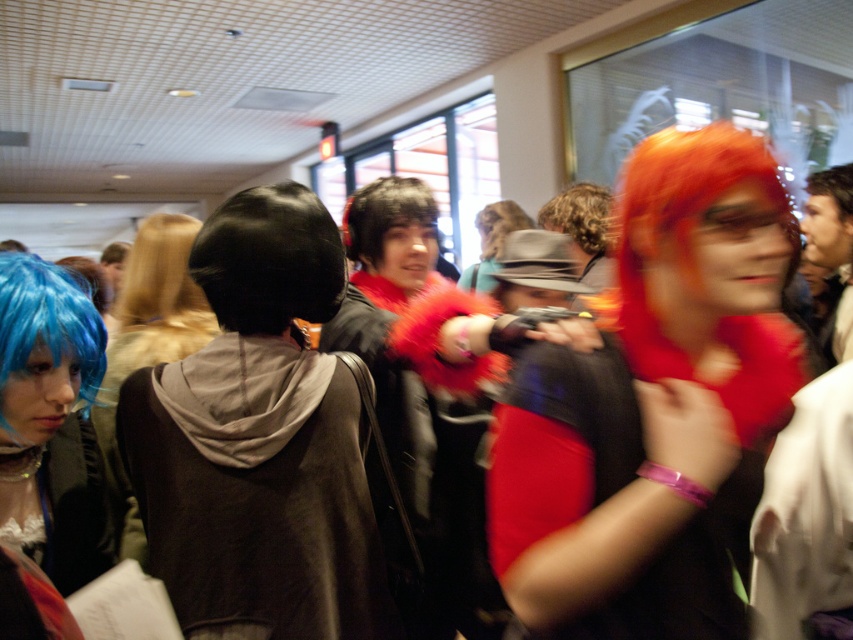
You are standing in the hallway and see two people with blondehair at center and shiny brown hair at center. Which one is more to the left?

The blondehair at center is more to the left side of the shiny brown hair at center.

From the picture: You are navigating through the hallway in the image and want to reach the point marked as point (x=256, y=333). There is an obstacle at point (x=172, y=266). Can you safely move around the obstacle to reach your destination?

Yes, you can safely move around the obstacle at point (x=172, y=266) because point (x=256, y=333) is in front of it, meaning there is space to navigate around the obstacle and reach your destination.

You are a photographer trying to capture a group photo of the black velvet hoodie at center and the blondehair at center. Based on their heights, which one should you position closer to the camera to ensure both are fully visible in the frame?

The black velvet hoodie at center is taller than blondehair at center. To ensure both are fully visible in the frame, position the blondehair at center closer to the camera so the taller black velvet hoodie at center doesn